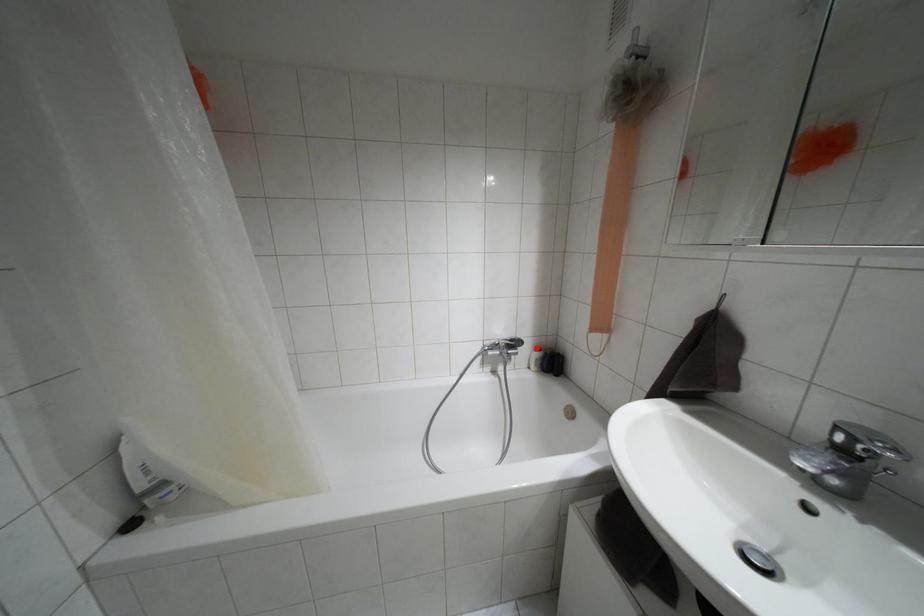
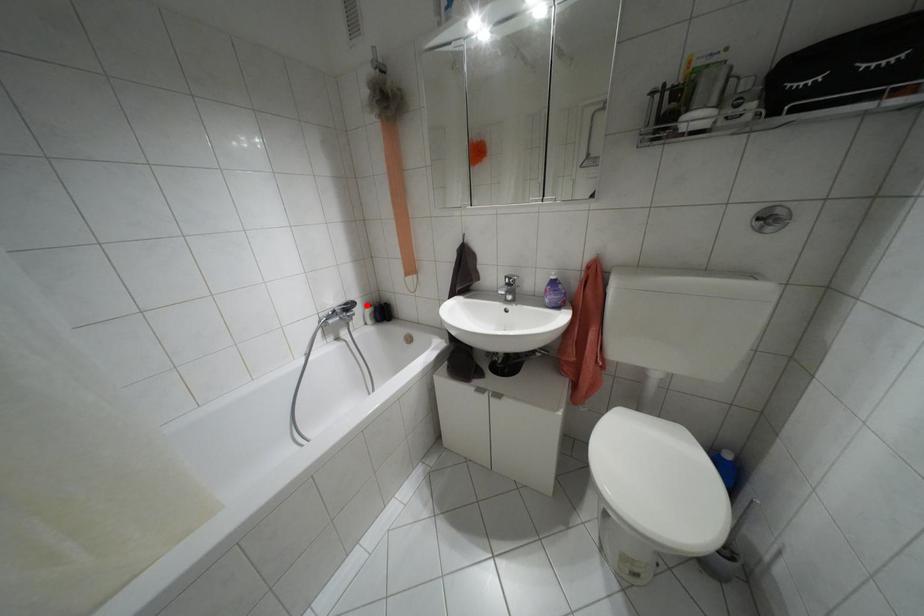
I am providing you with two images of the same scene from different viewpoints. A red point is marked on the first image and another point is marked on the second image. Do the highlighted points in image1 and image2 indicate the same real-world spot?

Yes